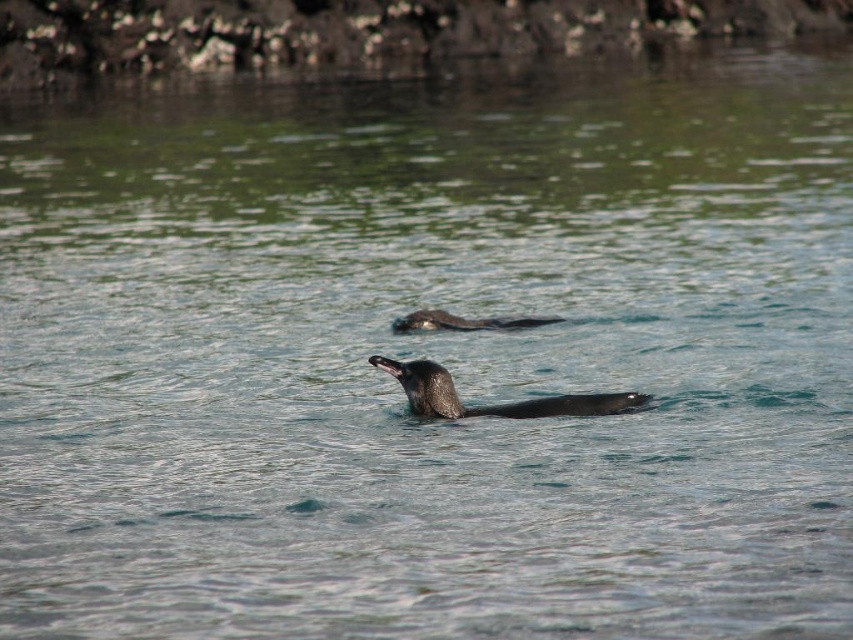
You are a marine biologist observing two otters in the water. You notice a shiny black otter at center and a black matte otter at center. Which otter has a wider body?

The shiny black otter at center might be wider than black matte otter at center.

You are a photographer trying to capture the shiny black otter at center in the image. Based on its position, which direction should you move your camera to focus on it?

The shiny black otter at center is located at point coordinates approximately 0.634 on the x axis and 0.578 on the y axis. Since the center of the image is typically at coordinates (426, 320), this means the otter is slightly to the right and above the center. To focus on it, you should move your camera slightly to the right and upwards.

You are a marine biologist observing two otters in the water. You notice a shiny black otter at center and a black matte otter at center. Which otter has a more reflective surface?

The shiny black otter at center has a more reflective surface than the black matte otter at center.